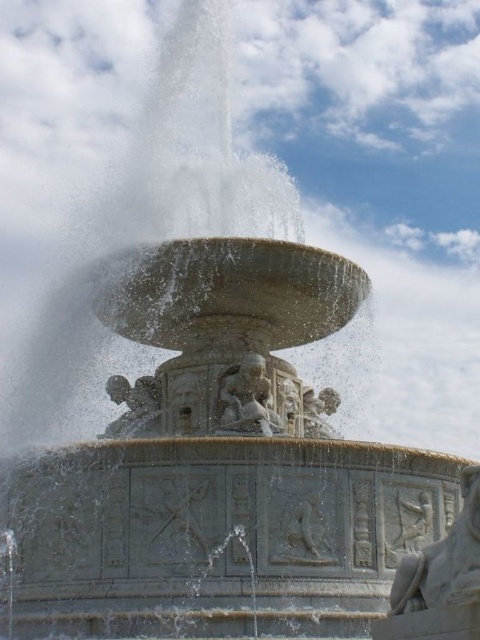
Question: Which point is closer to the camera?

Choices:
 (A) white marble statue at center
 (B) polished stone cherub at center
 (C) carved stone cherub at center

Answer: (A)

Question: Which point is farther to the camera?

Choices:
 (A) (137, 404)
 (B) (456, 573)
 (C) (268, 403)
 (D) (302, 408)

Answer: (D)

Question: Does white marble statue at center have a lesser width compared to polished stone cherub at center?

Choices:
 (A) no
 (B) yes

Answer: (A)

Question: Which point is farther from the camera taking this photo?

Choices:
 (A) (132, 392)
 (B) (274, 426)
 (C) (443, 604)
 (D) (334, 396)

Answer: (D)

Question: Is gray stone relief at center wider than carved stone cherub at center?

Choices:
 (A) yes
 (B) no

Answer: (A)

Question: Does white marble statue at center have a greater width compared to carved stone cherub at center?

Choices:
 (A) yes
 (B) no

Answer: (B)